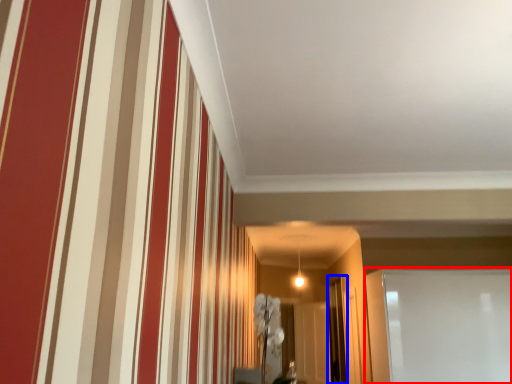
Question: Which point is further to the camera, glass door (highlighted by a red box) or glass door (highlighted by a blue box)?

Choices:
 (A) glass door
 (B) glass door

Answer: (B)